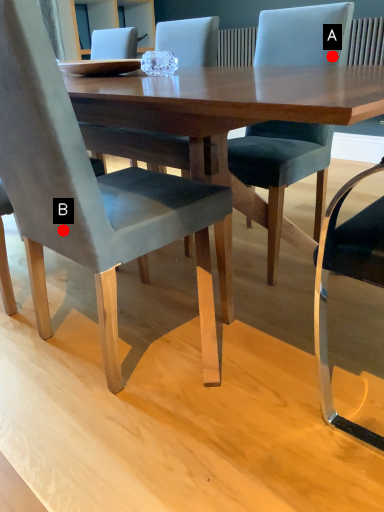
Question: Two points are circled on the image, labeled by A and B beside each circle. Which of the following is the farthest from the observer?

Choices:
 (A) A is further
 (B) B is further

Answer: (A)